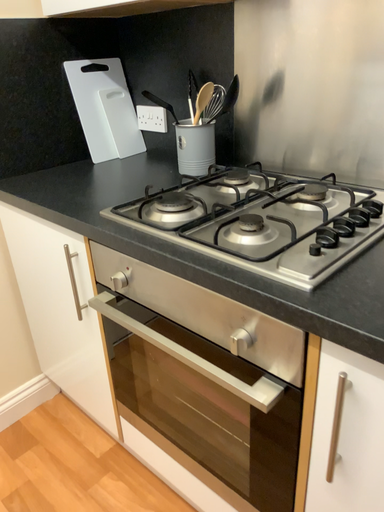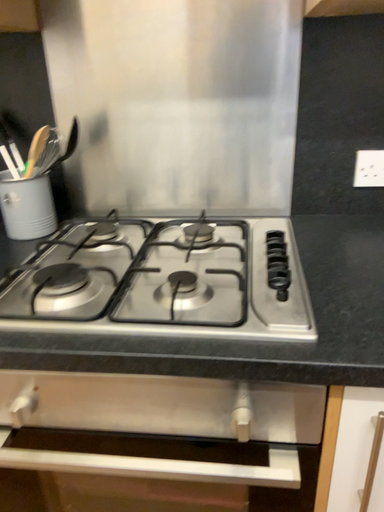
Question: How did the camera likely rotate when shooting the video?

Choices:
 (A) rotated downward
 (B) rotated upward

Answer: (B)